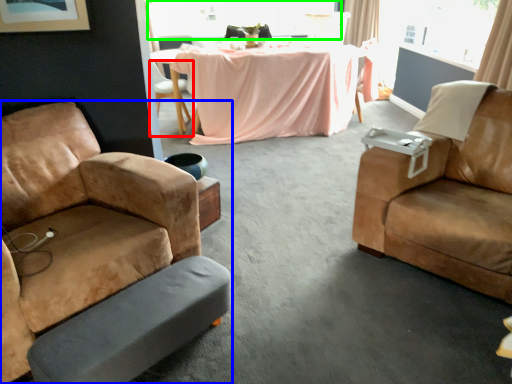
Question: Which object is positioned closest to chair (highlighted by a red box)? Select from chair (highlighted by a blue box) and window (highlighted by a green box).

Choices:
 (A) chair
 (B) window

Answer: (B)